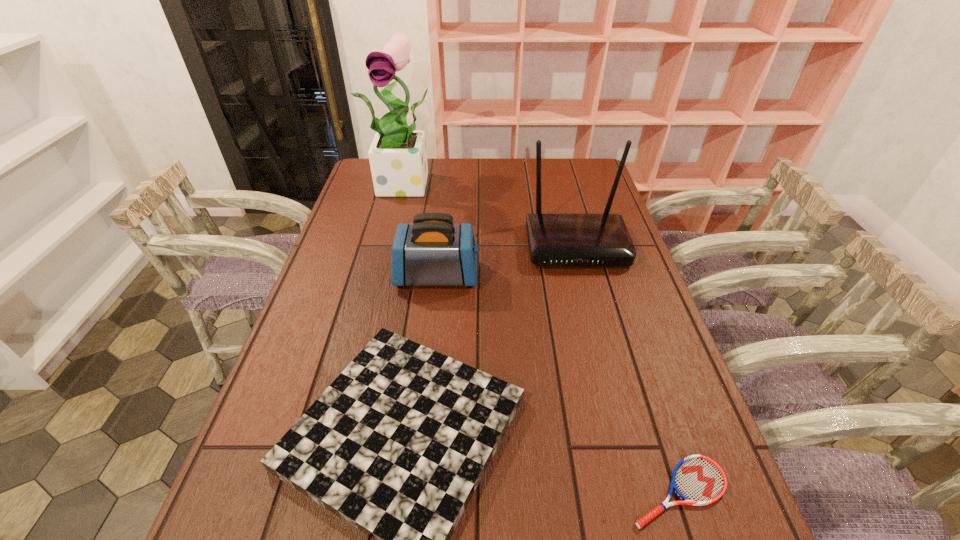
Locate an element on the screen. This screenshot has width=960, height=540. object that is at the left edge is located at coordinates (398, 159).

The width and height of the screenshot is (960, 540). Identify the location of router that is at the right edge. (555, 240).

Find the location of a particular element. The image size is (960, 540). tennis racket that is at the right edge is located at coordinates (698, 480).

Image resolution: width=960 pixels, height=540 pixels. Find the location of `object that is positioned at the far left corner`. object that is positioned at the far left corner is located at coordinates 398,159.

You are a GUI agent. You are given a task and a screenshot of the screen. Output one action in this format:
    pyautogui.click(x=<x>, y=<y>)
    Task: Click on the free space at the left edge
    This screenshot has width=960, height=540.
    Given the screenshot: What is the action you would take?
    [267, 407]

At what (x,y) coordinates should I click in order to perform the action: click on vacant space at the right edge. Please return your answer as a coordinate pair (x, y). Looking at the image, I should click on (633, 355).

Image resolution: width=960 pixels, height=540 pixels. What are the coordinates of `free space at the far right corner of the desktop` in the screenshot? It's located at (559, 182).

Where is `vacant point located between the flower arrangement and the shortest object`? Image resolution: width=960 pixels, height=540 pixels. vacant point located between the flower arrangement and the shortest object is located at coordinates (543, 338).

I want to click on free space between the toaster and the router, so click(507, 261).

Where is `free spot between the router and the farthest object`? free spot between the router and the farthest object is located at coordinates (492, 214).